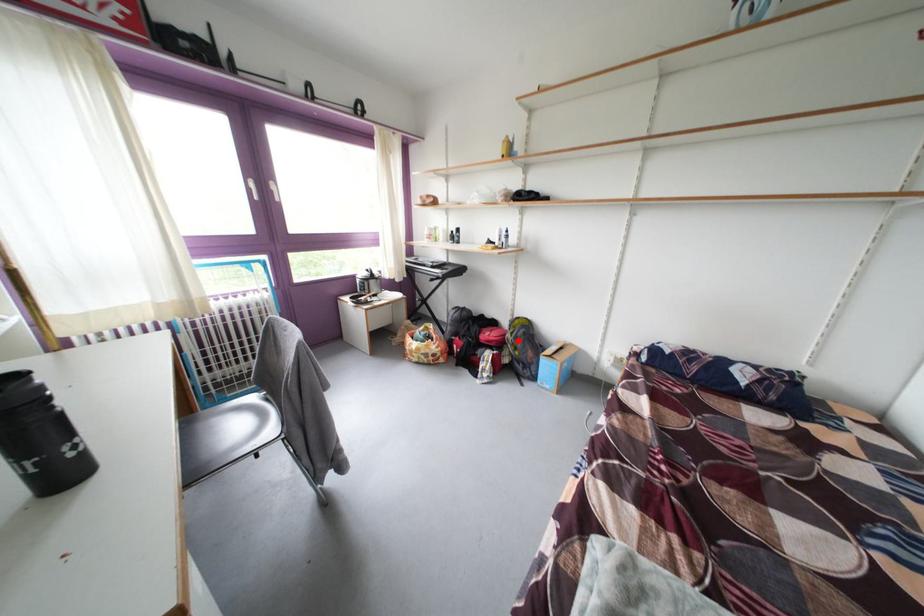
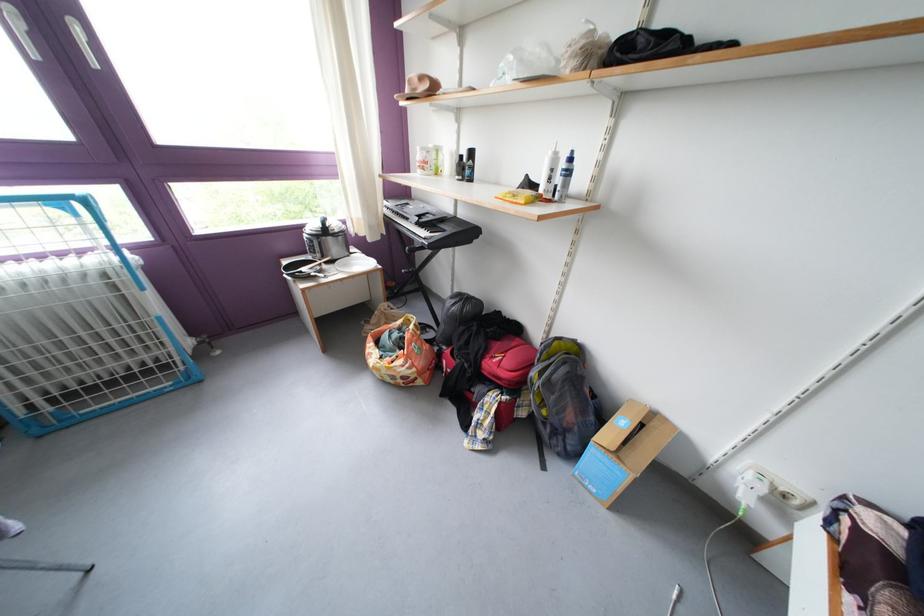
Question: I am providing you with two images of the same scene from different viewpoints. A red point is marked on the first image. At the location where the point appears in image 1, is it still visible in image 2?

Choices:
 (A) Yes
 (B) No

Answer: (A)